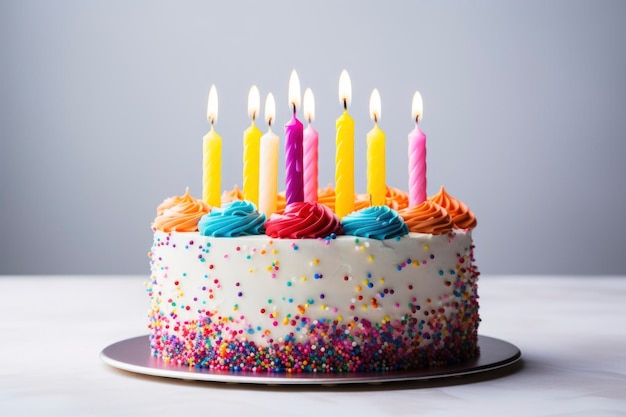
Identify the location of candle wicks. Image resolution: width=626 pixels, height=417 pixels. (212, 123), (253, 117), (270, 120), (295, 108), (309, 118), (342, 104), (375, 119), (414, 119).